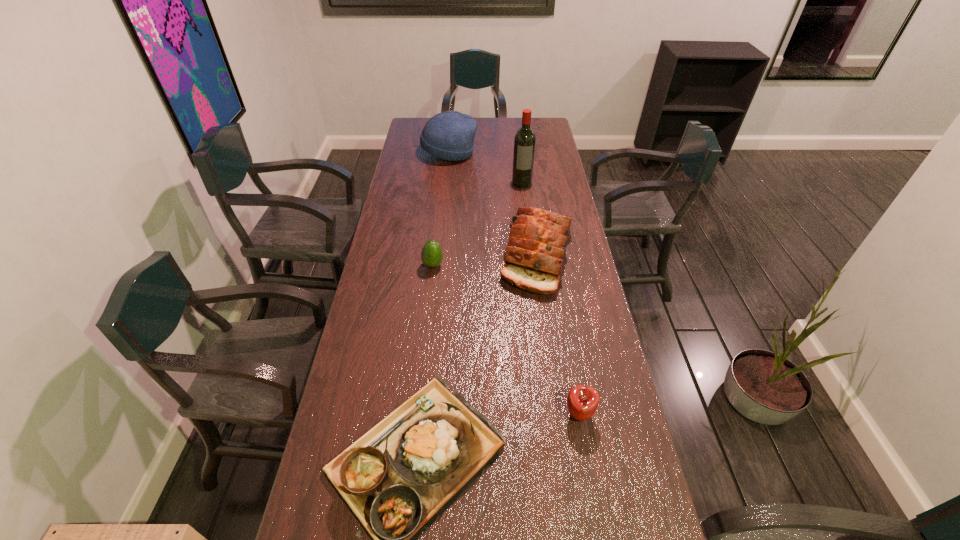
In the image, there is a desktop. Where is `vacant space at the far right corner`? This screenshot has height=540, width=960. vacant space at the far right corner is located at coordinates (550, 125).

Locate an element on the screen. vacant region between the fourth shortest object and the apple is located at coordinates (558, 334).

This screenshot has height=540, width=960. Identify the location of free spot between the farthest object and the bread. (493, 204).

Where is `unoccupied position between the bread and the skullcap`? unoccupied position between the bread and the skullcap is located at coordinates click(x=493, y=204).

Where is `vacant space that is in between the farthest object and the tallest object`? vacant space that is in between the farthest object and the tallest object is located at coordinates (486, 168).

Find the location of a particular element. This screenshot has width=960, height=540. free space between the apple and the bread is located at coordinates (558, 334).

I want to click on vacant region between the avocado and the apple, so click(506, 340).

Find the location of a particular element. The height and width of the screenshot is (540, 960). object that is the nearest to the skullcap is located at coordinates (524, 143).

Point out which object is positioned as the third nearest to the fourth shortest object. Please provide its 2D coordinates. Your answer should be formatted as a tuple, i.e. [(x, y)], where the tuple contains the x and y coordinates of a point satisfying the conditions above.

[(397, 478)]

Locate an element on the screen. The image size is (960, 540). free space that satisfies the following two spatial constraints: 1. on the label of the bread; 2. on the right side of the fifth nearest object is located at coordinates (531, 254).